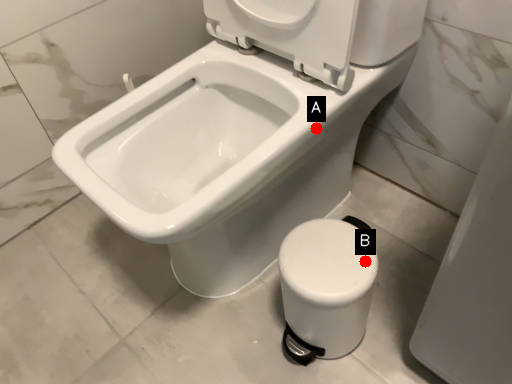
Question: Two points are circled on the image, labeled by A and B beside each circle. Which point is closer to the camera taking this photo?

Choices:
 (A) A is closer
 (B) B is closer

Answer: (B)